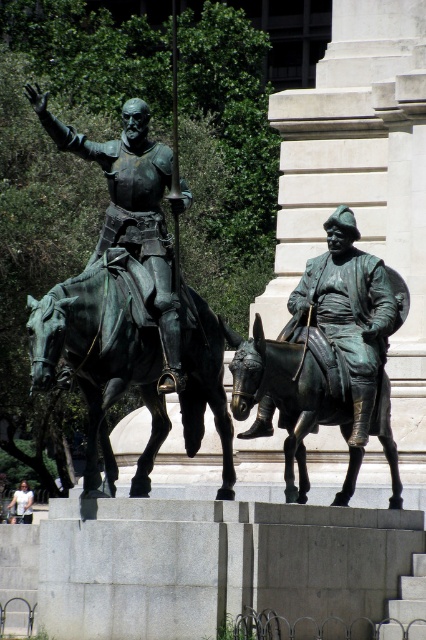
Question: Among these points, which one is farthest from the camera?

Choices:
 (A) (127, 272)
 (B) (14, 499)
 (C) (115, 216)
 (D) (273, 385)

Answer: (B)

Question: Which point appears closest to the camera in this image?

Choices:
 (A) (141, 118)
 (B) (109, 326)
 (C) (19, 488)

Answer: (B)

Question: Among these points, which one is farthest from the camera?

Choices:
 (A) click(14, 518)
 (B) click(45, 324)

Answer: (A)

Question: Does bronze statue of horse at left come behind bronze statue of man on horse at center?

Choices:
 (A) no
 (B) yes

Answer: (A)

Question: Can you confirm if bronze statue of horse at left is bigger than bronze statue of man on horse at center?

Choices:
 (A) no
 (B) yes

Answer: (A)

Question: Can you confirm if bronze statue of horse at left is positioned to the left of bronze statue of donkey at center?

Choices:
 (A) no
 (B) yes

Answer: (B)